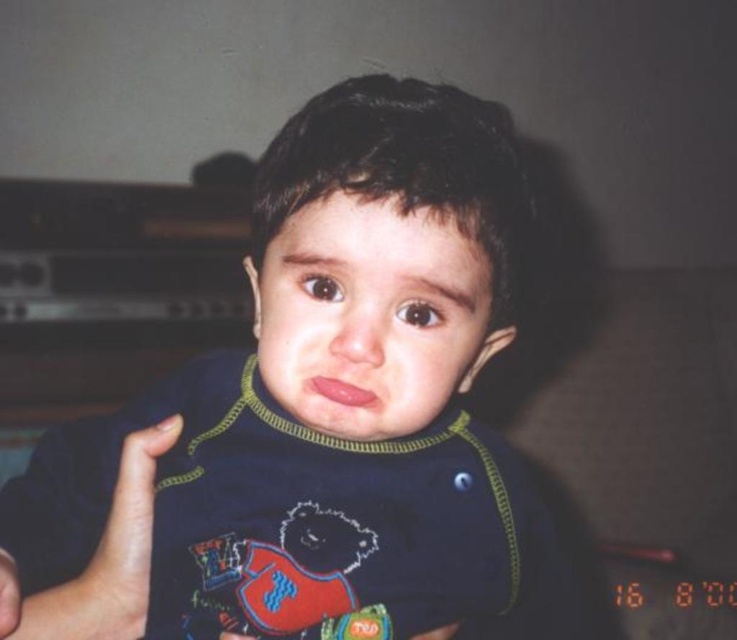
Question: Can you confirm if dark blue fabric at center is positioned to the left of smooth skin hand at lower left?

Choices:
 (A) no
 (B) yes

Answer: (A)

Question: Which of the following is the farthest from the observer?

Choices:
 (A) (129, 632)
 (B) (312, 342)

Answer: (A)

Question: Is dark blue fabric at center closer to camera compared to smooth skin hand at lower left?

Choices:
 (A) yes
 (B) no

Answer: (A)

Question: Can you confirm if dark blue fabric at center is positioned below smooth skin hand at lower left?

Choices:
 (A) no
 (B) yes

Answer: (A)